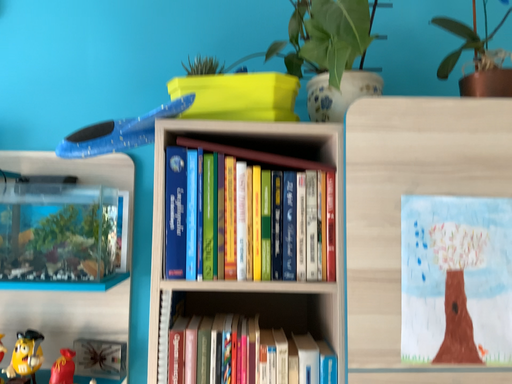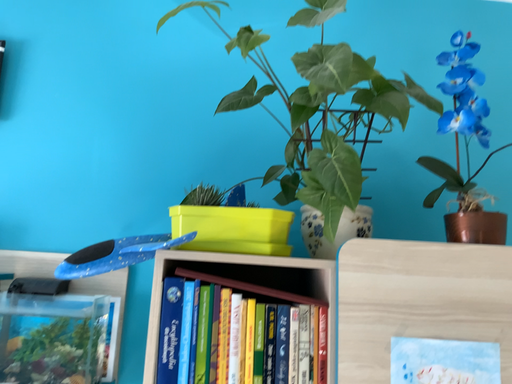
Question: Which way did the camera rotate in the video?

Choices:
 (A) rotated downward
 (B) rotated upward

Answer: (B)